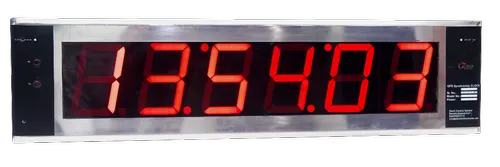
Find the location of a particular element. frame is located at coordinates (81, 127), (106, 33), (359, 30), (310, 116).